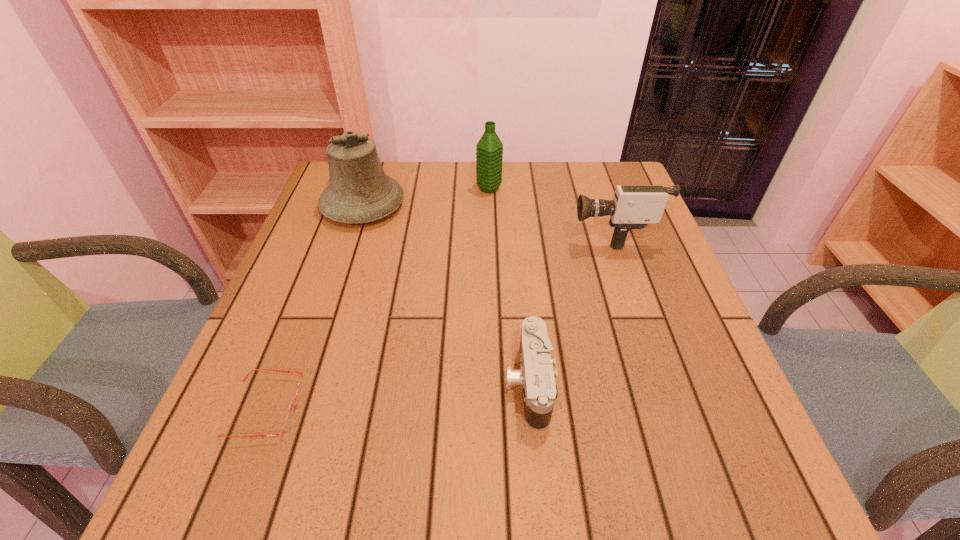
The image size is (960, 540). I want to click on object that is at the far left corner, so click(359, 191).

Locate an element on the screen. Image resolution: width=960 pixels, height=540 pixels. vacant region at the far edge is located at coordinates (444, 172).

Identify the location of vacant space at the near edge. point(439,461).

The image size is (960, 540). In the image, there is a desktop. What are the coordinates of `free space at the left edge` in the screenshot? It's located at (333, 303).

This screenshot has height=540, width=960. What are the coordinates of `free space at the right edge of the desktop` in the screenshot? It's located at (753, 437).

In the image, there is a desktop. Identify the location of blank space at the near left corner. This screenshot has width=960, height=540. (268, 462).

Find the location of a particular element. Image resolution: width=960 pixels, height=540 pixels. vacant space that's between the camera and the bell is located at coordinates (445, 294).

You are a GUI agent. You are given a task and a screenshot of the screen. Output one action in this format:
    pyautogui.click(x=<x>, y=<y>)
    Task: Click on the free spot between the bell and the camera
    This screenshot has width=960, height=540.
    Given the screenshot: What is the action you would take?
    pyautogui.click(x=445, y=294)

What are the coordinates of `unoccupied area between the camera and the bell` in the screenshot? It's located at (445, 294).

Find the location of a particular element. The width and height of the screenshot is (960, 540). vacant space that is in between the water bottle and the fourth tallest object is located at coordinates (509, 286).